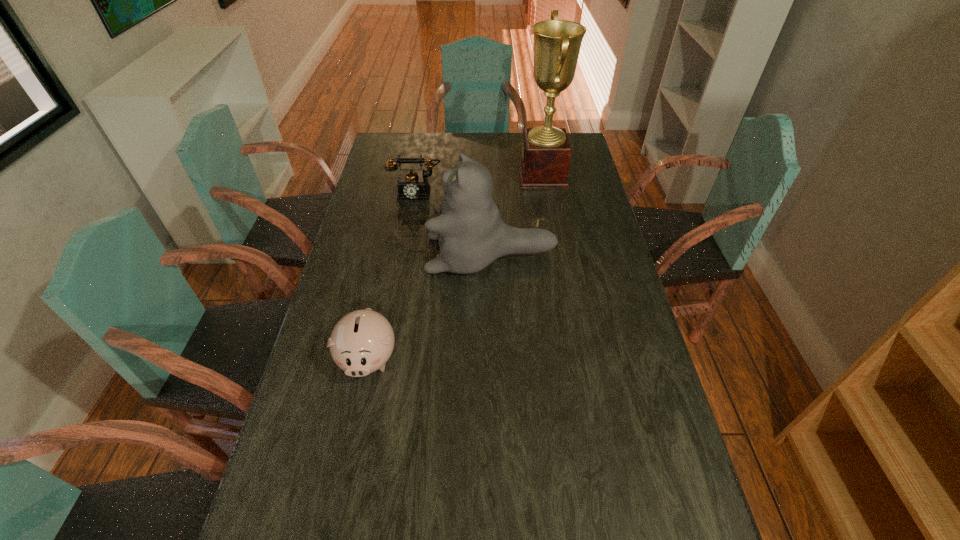
The height and width of the screenshot is (540, 960). What are the coordinates of `free space located 0.180m on the face of the third shortest object` in the screenshot? It's located at (372, 254).

I want to click on free space located on the front of the telephone at the rotary dial, so click(x=401, y=276).

The width and height of the screenshot is (960, 540). I want to click on free space located on the right of the piggy bank, so click(x=446, y=357).

Locate an element on the screen. This screenshot has height=540, width=960. object situated at the far edge is located at coordinates (545, 156).

What are the coordinates of `telephone at the left edge` in the screenshot? It's located at pyautogui.click(x=411, y=185).

Identify the location of piggy bank that is at the left edge. The height and width of the screenshot is (540, 960). (362, 341).

Find the location of a particular element. The width and height of the screenshot is (960, 540). object positioned at the right edge is located at coordinates (545, 156).

Find the location of a particular element. This screenshot has height=540, width=960. object present at the far right corner is located at coordinates (545, 156).

In the image, there is a desktop. Identify the location of vacant space at the far edge. (427, 133).

Where is `free space at the left edge`? The image size is (960, 540). free space at the left edge is located at coordinates (293, 446).